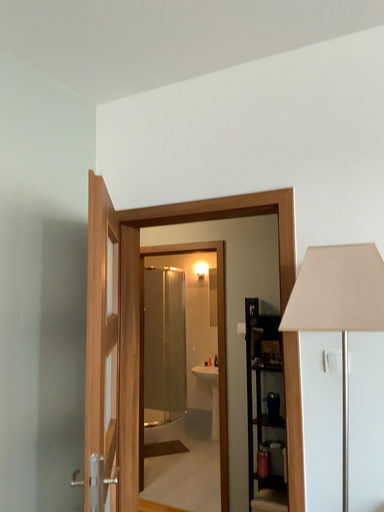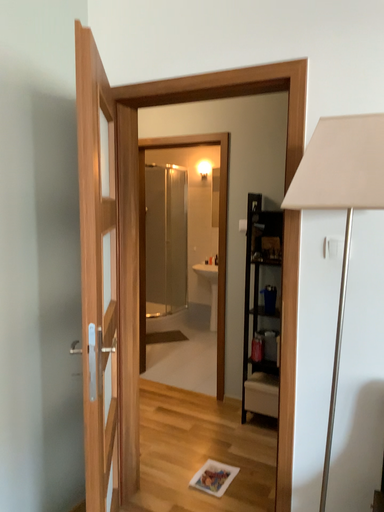
Question: Which way did the camera rotate in the video?

Choices:
 (A) rotated downward
 (B) rotated upward

Answer: (A)